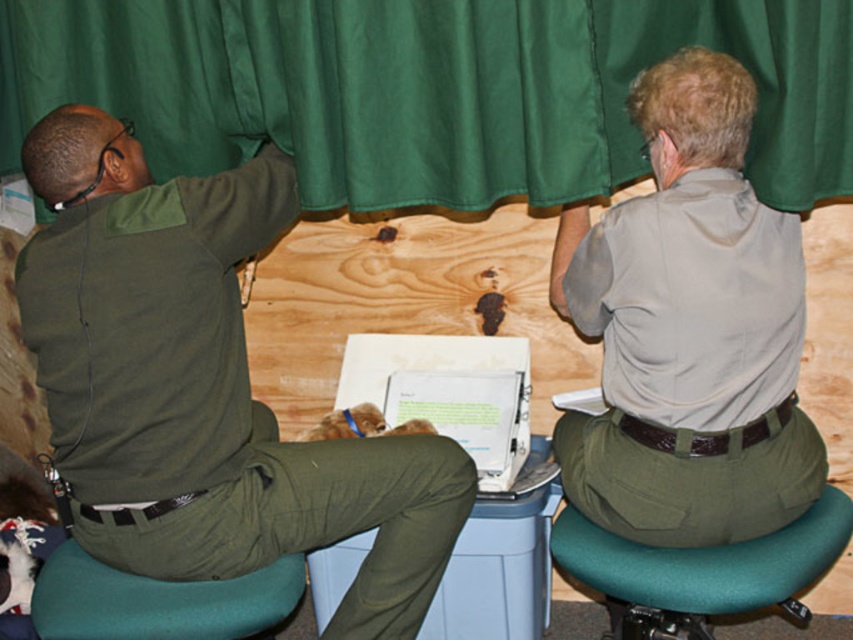
Does green fabric curtain at upper center lie in front of green matte uniform at left?

Yes, green fabric curtain at upper center is closer to the viewer.

Can you confirm if green fabric curtain at upper center is thinner than green matte uniform at left?

In fact, green fabric curtain at upper center might be wider than green matte uniform at left.

Locate an element on the screen. This screenshot has width=853, height=640. green fabric curtain at upper center is located at coordinates (428, 90).

Identify the location of green fabric curtain at upper center. (428, 90).

Does point (566, 36) come closer to viewer compared to point (837, 557)?

Yes, point (566, 36) is in front of point (837, 557).

Is green fabric curtain at upper center positioned in front of green fabric bar stool at lower right?

Yes, it is.

Between point (165, 80) and point (703, 620), which one is positioned behind?

Point (703, 620)

Where is `green fabric curtain at upper center`? green fabric curtain at upper center is located at coordinates (428, 90).

Which is in front, point (595, 150) or point (596, 308)?

Positioned in front is point (596, 308).

Between point (233, 99) and point (746, 440), which one is positioned in front?

Positioned in front is point (746, 440).

At what (x,y) coordinates should I click in order to perform the action: click on green fabric curtain at upper center. Please return your answer as a coordinate pair (x, y). Looking at the image, I should click on (428, 90).